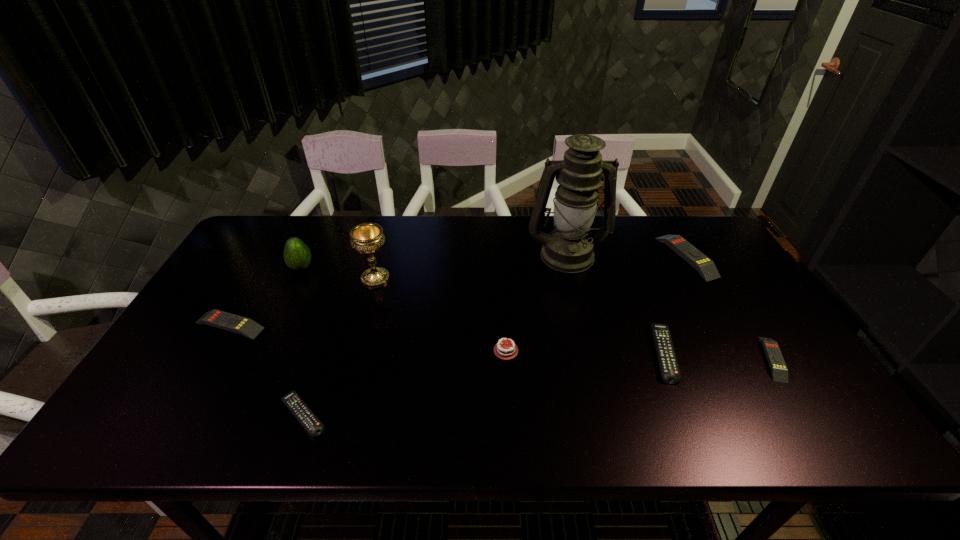
In order to click on vacant space that satisfies the following two spatial constraints: 1. on the front side of the red chocolate cake; 2. on the left side of the seventh object from left to right in this screenshot , I will do `click(506, 353)`.

Locate an element on the screen. The width and height of the screenshot is (960, 540). free spot that satisfies the following two spatial constraints: 1. on the front side of the leftmost remote control; 2. on the right side of the fifth object from right to left is located at coordinates (215, 350).

Find the location of a particular element. This screenshot has height=540, width=960. free space that satisfies the following two spatial constraints: 1. on the back side of the chalice; 2. on the right side of the shortest object is located at coordinates (349, 279).